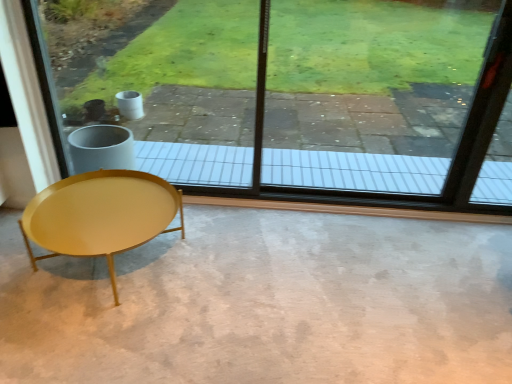
Question: Based on their positions, is smooth concrete floor at center located to the left or right of transparent glass window at center?

Choices:
 (A) left
 (B) right

Answer: (A)

Question: From their relative heights in the image, would you say smooth concrete floor at center is taller or shorter than transparent glass window at center?

Choices:
 (A) tall
 (B) short

Answer: (B)

Question: Based on their relative distances, which object is farther from the transparent glass window at center?

Choices:
 (A) smooth concrete floor at center
 (B) shiny gold coffee table at lower left

Answer: (B)

Question: Which object is the closest to the shiny gold coffee table at lower left?

Choices:
 (A) smooth concrete floor at center
 (B) transparent glass window at center

Answer: (A)